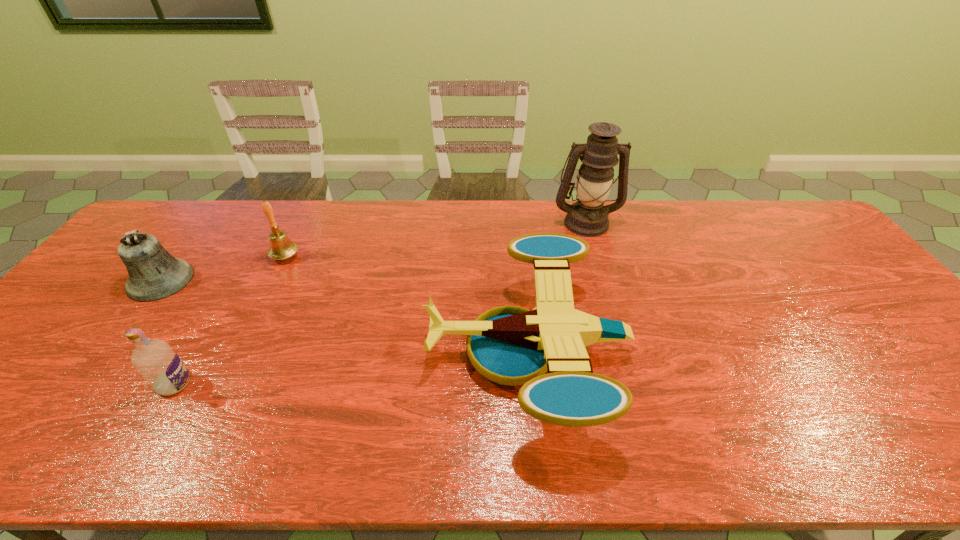
In order to click on the tallest object in this screenshot , I will do `click(587, 217)`.

What are the coordinates of `the farthest object` in the screenshot? It's located at (587, 217).

The image size is (960, 540). Find the location of `the right bell`. the right bell is located at coordinates (281, 247).

Where is `vodka`? vodka is located at coordinates (161, 367).

This screenshot has height=540, width=960. In order to click on the leftmost object in this screenshot , I will do `click(154, 274)`.

Locate an element on the screen. This screenshot has height=540, width=960. the shorter bell is located at coordinates (154, 274).

Where is `drone`? Image resolution: width=960 pixels, height=540 pixels. drone is located at coordinates (517, 349).

The width and height of the screenshot is (960, 540). Find the location of `vacant space located on the front of the farthest object`. vacant space located on the front of the farthest object is located at coordinates (606, 289).

I want to click on free space located on the front of the right bell, so click(254, 318).

Identify the location of free spot located 0.280m on the label of the vodka. Image resolution: width=960 pixels, height=540 pixels. (311, 383).